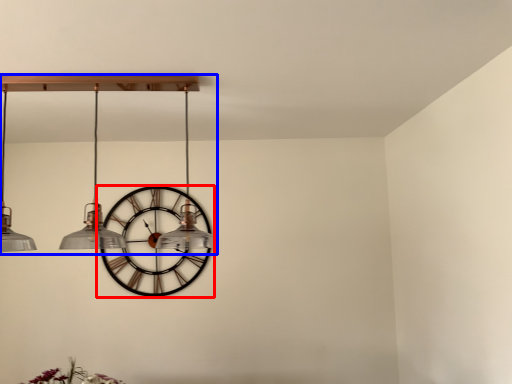
Question: Among these objects, which one is nearest to the camera, wall clock (highlighted by a red box) or chandelier (highlighted by a blue box)?

Choices:
 (A) wall clock
 (B) chandelier

Answer: (B)